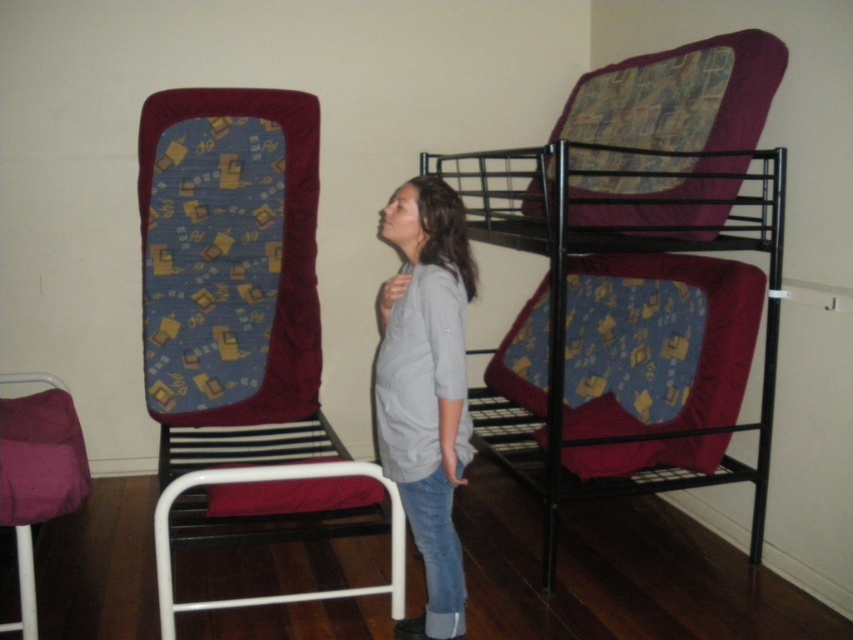
Does blue fabric chair at left have a larger size compared to purple fabric chair at lower left?

Yes.

Is blue fabric chair at left to the left of purple fabric chair at lower left from the viewer's perspective?

A: Incorrect, blue fabric chair at left is not on the left side of purple fabric chair at lower left.

Is point (286, 323) in front of point (33, 452)?

No, (286, 323) is further to viewer.

Find the location of a particular element. Image resolution: width=853 pixels, height=640 pixels. blue fabric chair at left is located at coordinates (241, 333).

Between point (485, 154) and point (415, 394), which one is positioned in front?

Point (415, 394) is more forward.

The height and width of the screenshot is (640, 853). Identify the location of maroon fabric bunk bed at right. (635, 278).

Does maroon fabric bunk bed at right have a larger size compared to purple fabric chair at lower left?

Yes, maroon fabric bunk bed at right is bigger than purple fabric chair at lower left.

Who is shorter, maroon fabric bunk bed at right or purple fabric chair at lower left?

Standing shorter between the two is purple fabric chair at lower left.

Where is `maroon fabric bunk bed at right`? This screenshot has width=853, height=640. maroon fabric bunk bed at right is located at coordinates (635, 278).